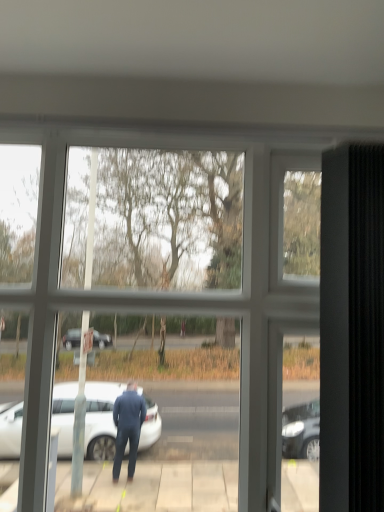
The width and height of the screenshot is (384, 512). I want to click on transparent glass screen door at center, so click(x=168, y=219).

Measure the distance between transparent glass screen door at center and camera.

transparent glass screen door at center is 1.17 meters away from camera.

Describe the element at coordinates (168, 219) in the screenshot. This screenshot has width=384, height=512. I see `transparent glass screen door at center` at that location.

This screenshot has width=384, height=512. In order to click on transparent glass screen door at center in this screenshot , I will do `click(168, 219)`.